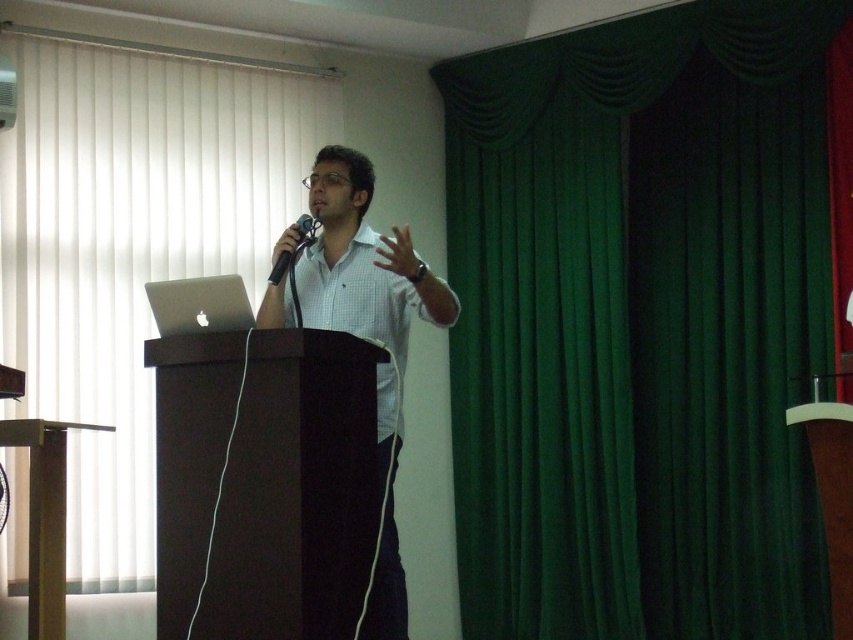
Question: Considering the relative positions of green fabric curtain at upper right and black matte microphone at center in the image provided, where is green fabric curtain at upper right located with respect to black matte microphone at center?

Choices:
 (A) below
 (B) above

Answer: (A)

Question: Estimate the real-world distances between objects in this image. Which object is closer to the green fabric curtain at upper right?

Choices:
 (A) dark wood podium at center
 (B) green velvet curtain at right

Answer: (B)

Question: Is green velvet curtain at right positioned in front of dark wood podium at center?

Choices:
 (A) yes
 (B) no

Answer: (B)

Question: Estimate the real-world distances between objects in this image. Which object is closer to the dark wood podium at center?

Choices:
 (A) black matte microphone at center
 (B) green fabric curtain at upper right
 (C) green velvet curtain at right

Answer: (A)

Question: Is dark wood podium at center to the right of white checkered shirt at center from the viewer's perspective?

Choices:
 (A) yes
 (B) no

Answer: (B)

Question: Among these objects, which one is farthest from the camera?

Choices:
 (A) dark wood podium at center
 (B) white checkered shirt at center
 (C) green fabric curtain at upper right
 (D) black matte microphone at center

Answer: (C)